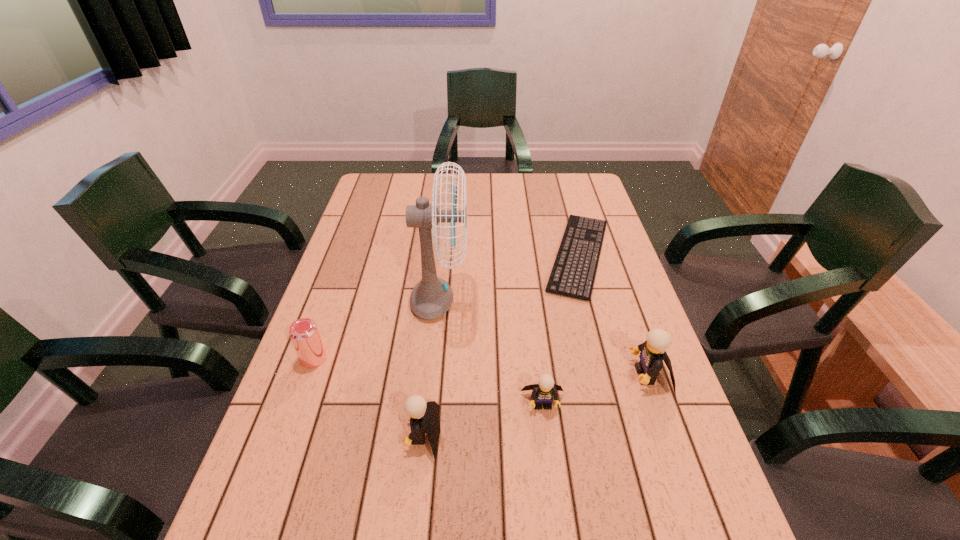
Image resolution: width=960 pixels, height=540 pixels. I want to click on computer keyboard that is at the right edge, so click(x=592, y=230).

Locate an element on the screen. The image size is (960, 540). free region at the far edge of the desktop is located at coordinates (530, 184).

Locate an element on the screen. The width and height of the screenshot is (960, 540). vacant space at the left edge of the desktop is located at coordinates (377, 214).

I want to click on vacant area at the right edge, so click(632, 341).

Where is `blank area at the far right corner`? The image size is (960, 540). blank area at the far right corner is located at coordinates (566, 187).

Identify the location of blank space at the near right corner. The image size is (960, 540). (646, 472).

You are a GUI agent. You are given a task and a screenshot of the screen. Output one action in this format:
    pyautogui.click(x=<x>, y=<y>)
    Task: Click on the vacant space that's between the second tallest Lego and the beer can
    This screenshot has width=960, height=540.
    Given the screenshot: What is the action you would take?
    pyautogui.click(x=369, y=396)

Identify the location of free space between the leftmost object and the second shortest Lego. (369, 396).

The image size is (960, 540). I want to click on free spot between the second tallest object and the computer keyboard, so click(613, 315).

Locate an element on the screen. The image size is (960, 540). free space that is in between the second Lego from left to right and the leftmost object is located at coordinates (428, 381).